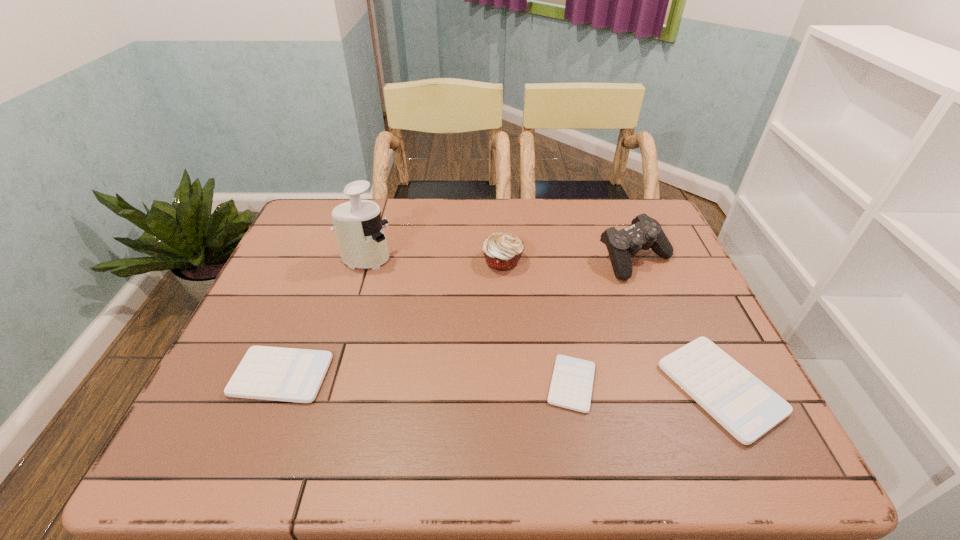
You are a GUI agent. You are given a task and a screenshot of the screen. Output one action in this format:
    pyautogui.click(x=<x>, y=<y>)
    Task: Click on the vacant space located 0.270m on the left of the rightmost calculator
    Image resolution: width=960 pixels, height=540 pixels.
    Given the screenshot: What is the action you would take?
    pyautogui.click(x=540, y=388)

You are a GUI agent. You are given a task and a screenshot of the screen. Output one action in this format:
    pyautogui.click(x=<x>, y=<y>)
    Task: Click on the vacant space located on the left of the control
    The height and width of the screenshot is (540, 960).
    Given the screenshot: What is the action you would take?
    pyautogui.click(x=458, y=260)

In order to click on free space located on the back of the juicer in this screenshot , I will do `click(372, 236)`.

Identify the location of vacant space located on the front of the muffin. (505, 301).

Locate an element on the screen. The height and width of the screenshot is (540, 960). object that is at the far edge is located at coordinates (644, 233).

The width and height of the screenshot is (960, 540). In order to click on object that is at the left edge in this screenshot , I will do `click(268, 373)`.

At what (x,y) coordinates should I click in order to perform the action: click on calculator positioned at the right edge. Please return your answer as a coordinate pair (x, y). The image size is (960, 540). Looking at the image, I should click on (747, 408).

This screenshot has height=540, width=960. In order to click on control that is at the right edge in this screenshot , I will do `click(644, 233)`.

This screenshot has width=960, height=540. Find the location of `object that is at the near left corner`. object that is at the near left corner is located at coordinates (268, 373).

Locate an element on the screen. object that is at the far right corner is located at coordinates (644, 233).